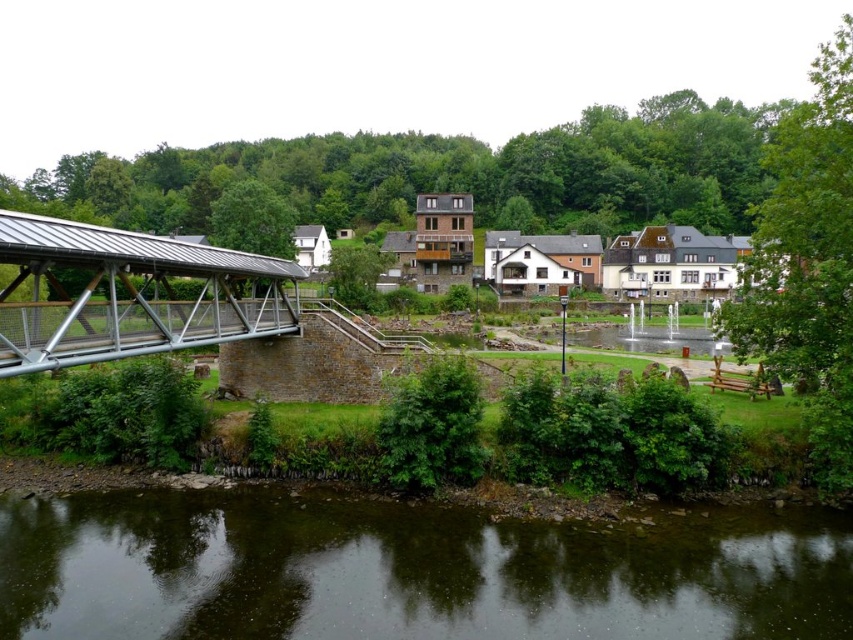
Question: Is dark brown water at lower center wider than metallic gray bridge at left?

Choices:
 (A) no
 (B) yes

Answer: (A)

Question: Does dark brown water at lower center appear on the left side of metallic gray bridge at left?

Choices:
 (A) yes
 (B) no

Answer: (B)

Question: Which point is farther to the camera?

Choices:
 (A) (171, 336)
 (B) (770, 616)

Answer: (A)

Question: Which object appears closest to the camera in this image?

Choices:
 (A) metallic gray bridge at left
 (B) dark brown water at lower center

Answer: (B)

Question: Is dark brown water at lower center thinner than metallic gray bridge at left?

Choices:
 (A) no
 (B) yes

Answer: (B)